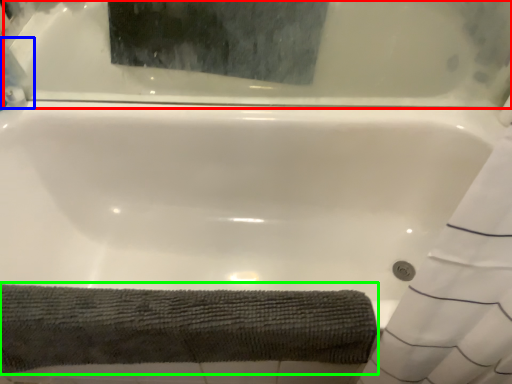
Question: Which object is positioned farthest from bathtub (highlighted by a red box)? Select from cleaning product (highlighted by a blue box) and bath towel (highlighted by a green box).

Choices:
 (A) cleaning product
 (B) bath towel

Answer: (B)